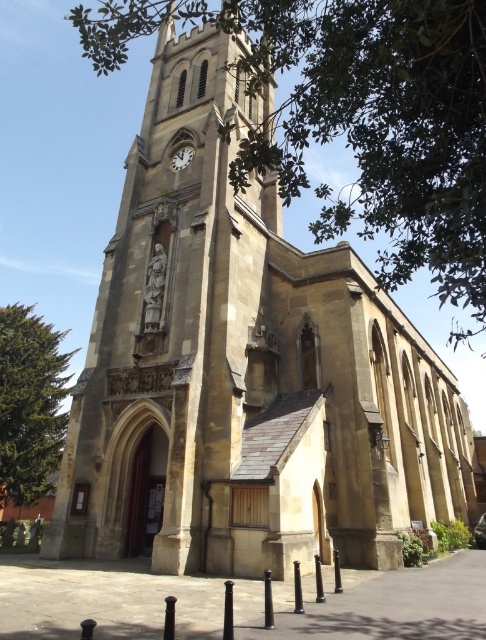
Is green leafy tree at left above white glossy clock at upper center?

No.

Which is above, green leafy tree at left or white glossy clock at upper center?

white glossy clock at upper center

Who is more distant from viewer, (35, 451) or (175, 156)?

Positioned behind is point (35, 451).

Where is `green leafy tree at left`? The image size is (486, 640). green leafy tree at left is located at coordinates [x=30, y=403].